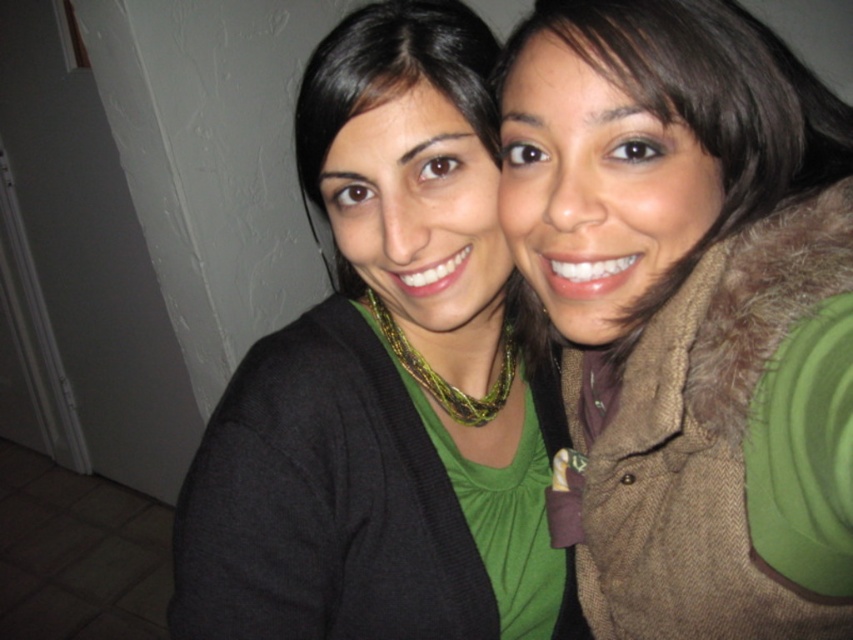
You are a photographer setting up a shoot in this indoor scene. You need to ensure that the green fuzzy vest at upper right and the black matte cardigan at center are both clearly visible in the final photo. Based on their positions, which clothing item might partially obscure the other?

The green fuzzy vest at upper right is in front of the black matte cardigan at center, so it might partially obscure the black matte cardigan at center in the photo.

In the scene shown: You are standing in the room and want to hand a gift to the person wearing the green fuzzy vest at upper right. Since the door frame is on the left side of the background, can you walk around the left side to reach them?

The green fuzzy vest at upper right is located at point (689, 312), which is on the upper right side of the image. The door frame is on the left side of the background. To reach the person wearing the green fuzzy vest at upper right, walking around the left side near the door frame would not be the most direct path since the vest is positioned towards the right. A better approach would be to move towards the right side of the scene to approach them more directly.